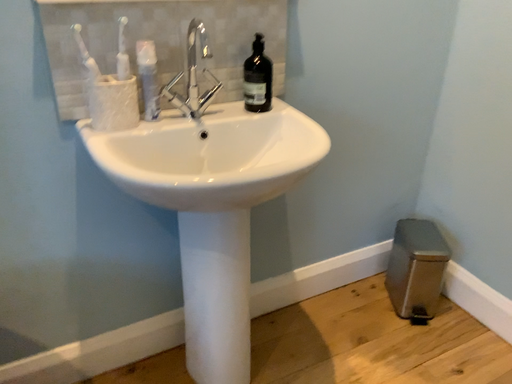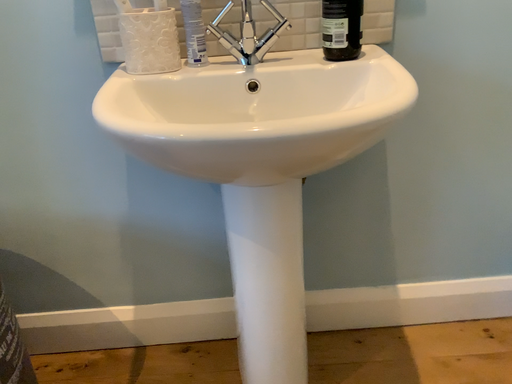
Question: Which way did the camera rotate in the video?

Choices:
 (A) rotated left
 (B) rotated right

Answer: (A)